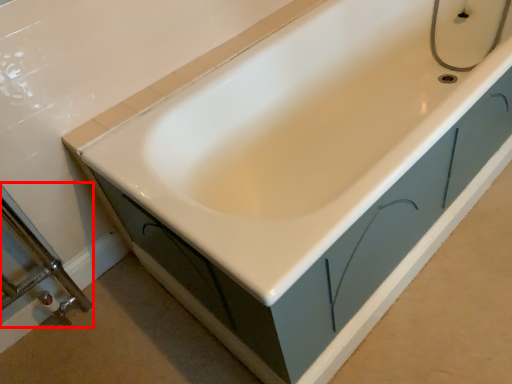
Question: In this image, where is shower door (annotated by the red box) located relative to plumbing fixture?

Choices:
 (A) left
 (B) right

Answer: (A)